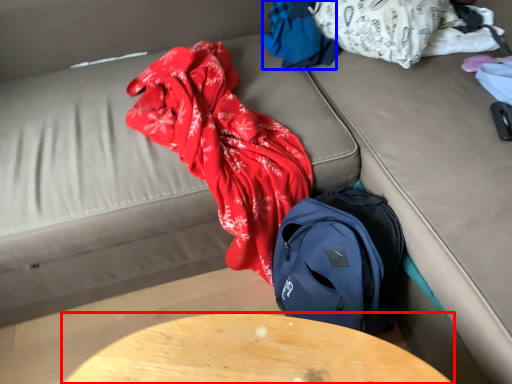
Question: Which point is further to the camera, table (highlighted by a red box) or clothing (highlighted by a blue box)?

Choices:
 (A) table
 (B) clothing

Answer: (B)